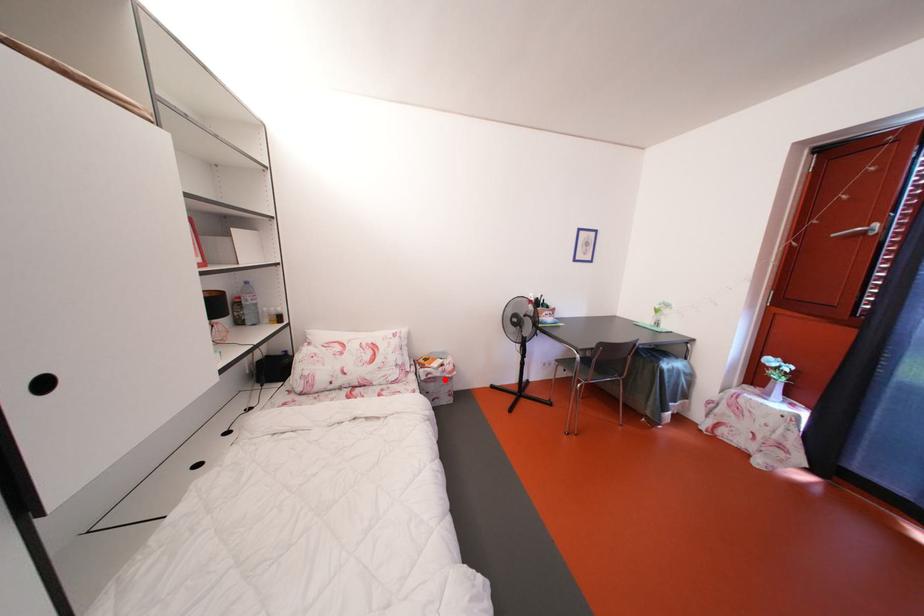
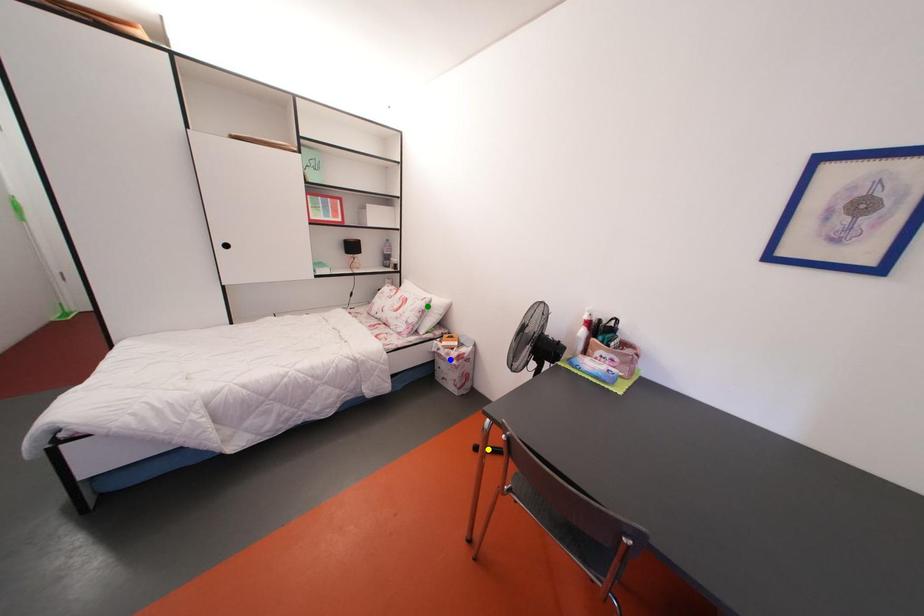
Question: I am providing you with two images of the same scene from different viewpoints. A red point is marked on the first image. You are given multiple points on the second image. In image 2, which mark is for the same physical point as the one in image 1?

Choices:
 (A) yellow point
 (B) green point
 (C) blue point

Answer: (C)